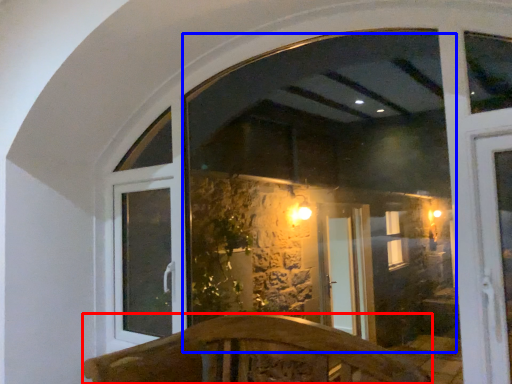
Question: Which of the following is the closest to the observer, furniture (highlighted by a red box) or window screen (highlighted by a blue box)?

Choices:
 (A) furniture
 (B) window screen

Answer: (A)